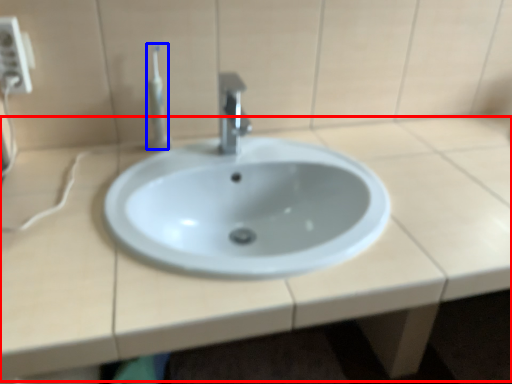
Question: Which of the following is the farthest to the observer, counter top (highlighted by a red box) or toothbrush (highlighted by a blue box)?

Choices:
 (A) counter top
 (B) toothbrush

Answer: (B)